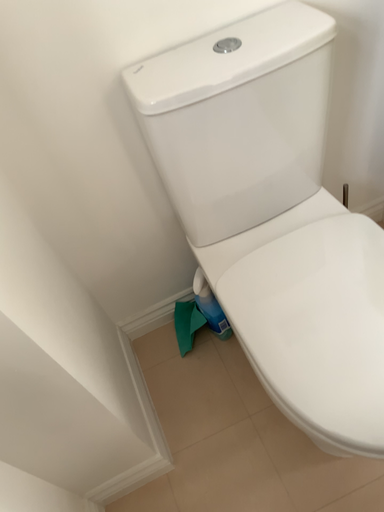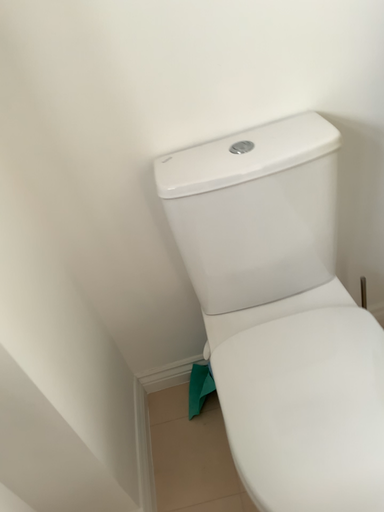
Question: How did the camera likely rotate when shooting the video?

Choices:
 (A) rotated left
 (B) rotated right

Answer: (A)